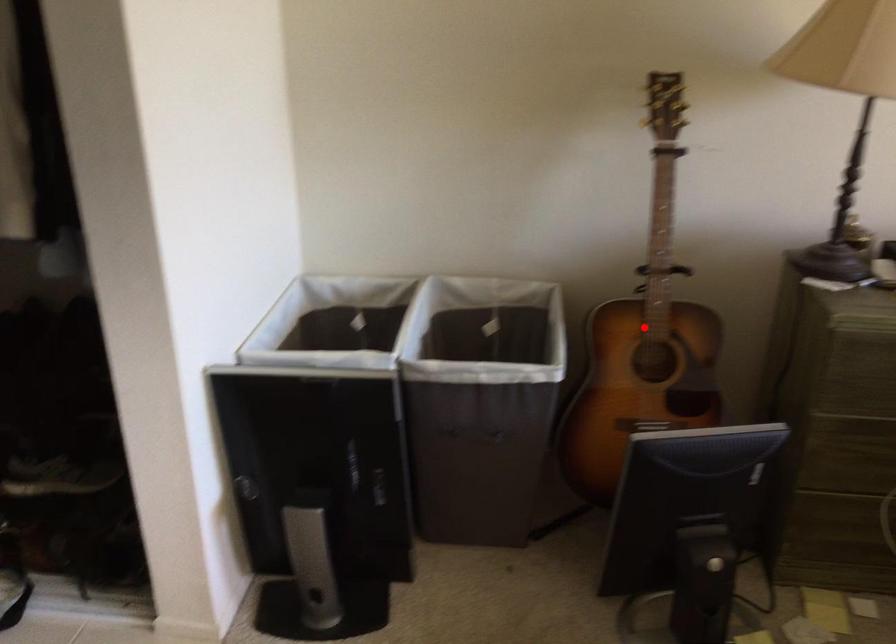
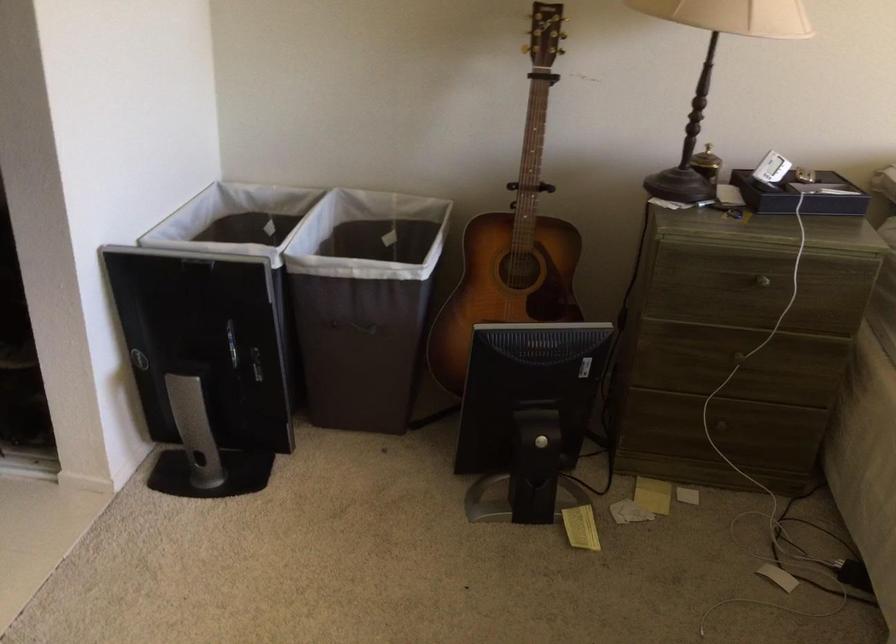
Locate, in the second image, the point that corresponds to the highlighted location in the first image.

(513, 237)